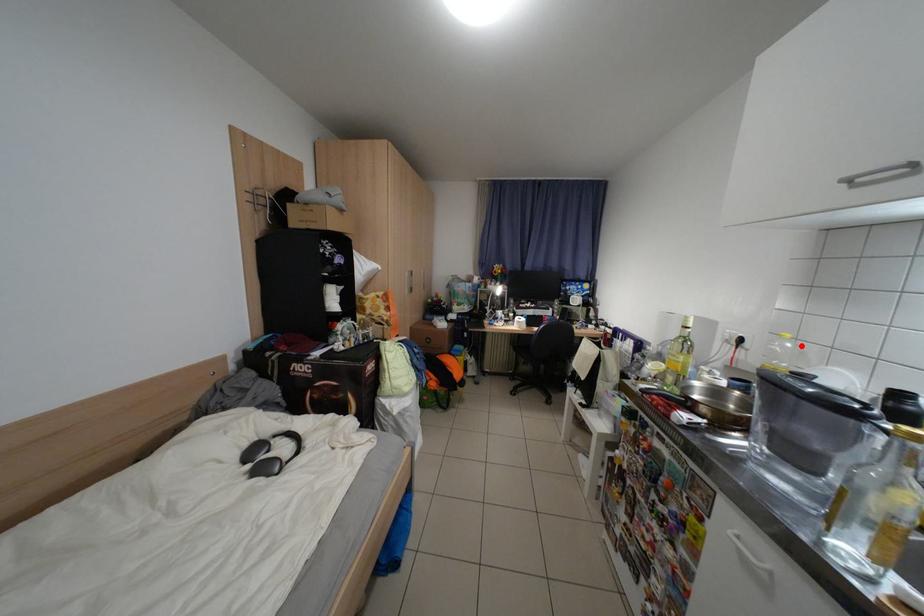
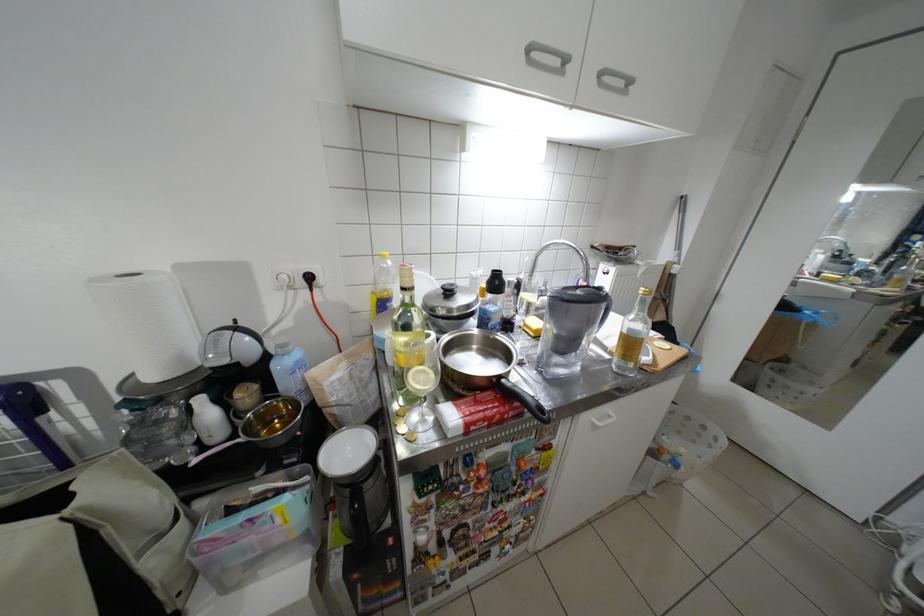
Where in the second image is the point corresponding to the highlighted location from the first image?

(400, 264)